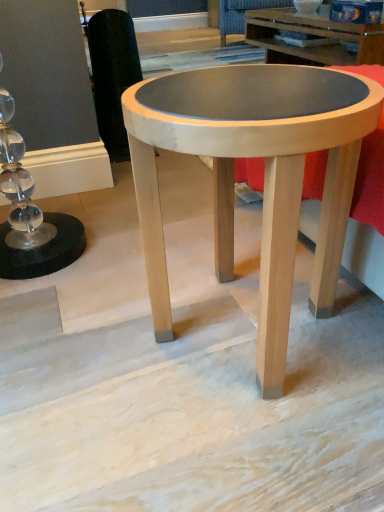
Where is `free space to the left of matte wood coffee table at center`? Image resolution: width=384 pixels, height=512 pixels. free space to the left of matte wood coffee table at center is located at coordinates point(79,339).